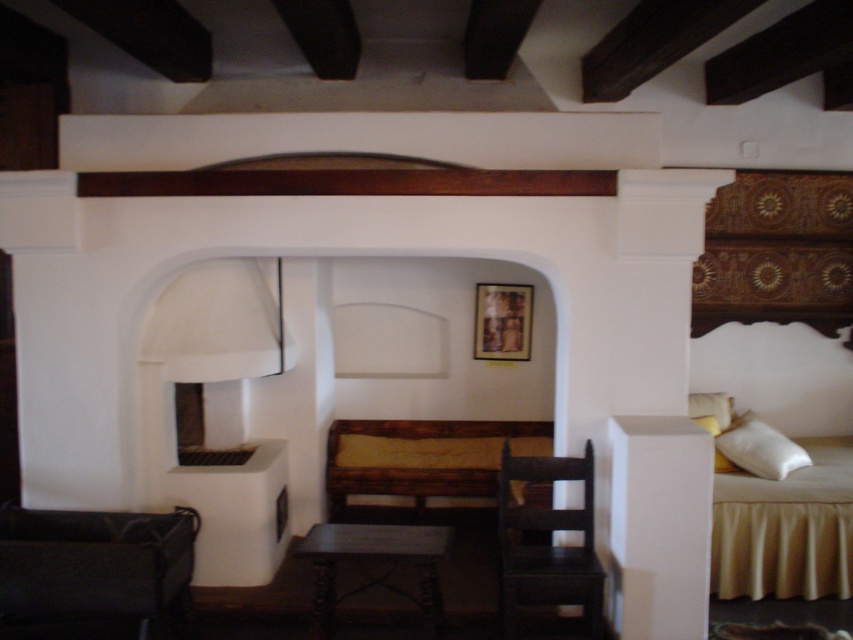
Question: Which point is closer to the camera?

Choices:
 (A) (758, 449)
 (B) (669, 460)
 (C) (392, 531)
 (D) (270, 538)

Answer: (B)

Question: Estimate the real-world distances between objects in this image. Which object is farther from the white matte pillar at right?

Choices:
 (A) white matte fireplace at left
 (B) black fabric armchair at lower left
 (C) dark wood chair at center
 (D) white soft pillow at right

Answer: (B)

Question: Is dark wood chair at center smaller than wooden table at center?

Choices:
 (A) no
 (B) yes

Answer: (B)

Question: From the image, what is the correct spatial relationship of white matte pillar at right in relation to dark wood chair at center?

Choices:
 (A) below
 (B) above

Answer: (B)

Question: In this image, where is white matte pillar at right located relative to dark brown wooden bed at center?

Choices:
 (A) above
 (B) below

Answer: (A)

Question: Which object is closer to the camera taking this photo?

Choices:
 (A) white matte pillar at right
 (B) dark brown wooden bed at center
 (C) white soft pillow at right

Answer: (A)